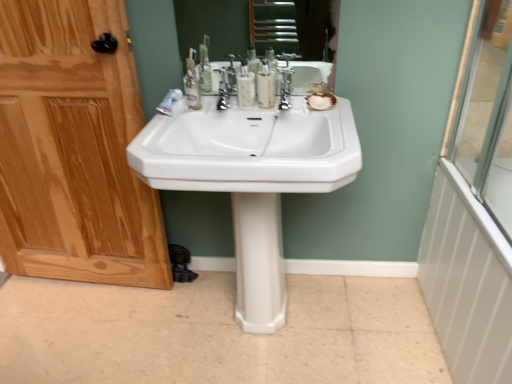
Question: From the image's perspective, is white glossy radiator at right positioned above or below translucent plastic mouthwash at center, the second mouthwash from the right?

Choices:
 (A) below
 (B) above

Answer: (A)

Question: Would you say white glossy radiator at right is inside or outside translucent plastic mouthwash at center, the second mouthwash from the right?

Choices:
 (A) inside
 (B) outside

Answer: (B)

Question: Which object is the farthest from the transparent glass shower door at right?

Choices:
 (A) white glossy toothpaste at center
 (B) white glossy sink at center
 (C) polished chrome faucet at center, which is the 2th faucet from left to right
 (D) polished chrome faucet at center, which ranks as the 1th faucet in left-to-right order
 (E) white matte shell at center

Answer: (A)

Question: Estimate the real-world distances between objects in this image. Which object is farther from the wooden door at left?

Choices:
 (A) white glossy pedestal at center
 (B) white glossy radiator at right
 (C) white glossy toothpaste at center
 (D) polished chrome faucet at center, which ranks as the 1th faucet in left-to-right order
 (E) transparent glass shower door at right

Answer: (E)